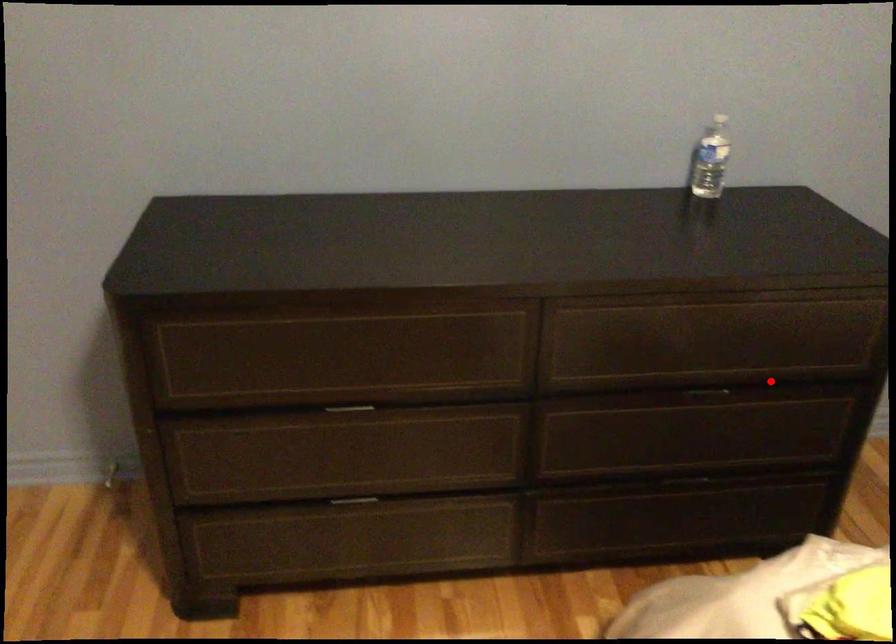
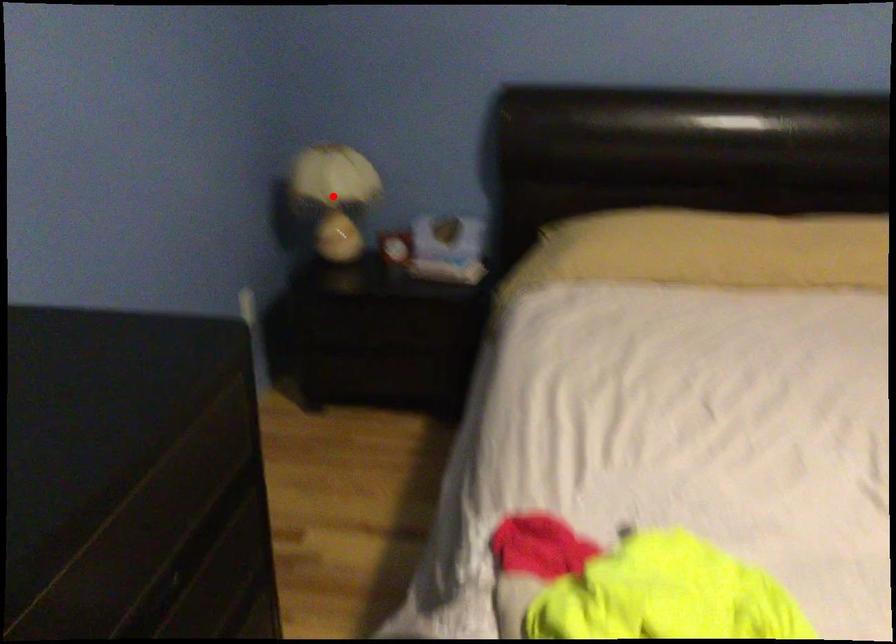
I am providing you with two images of the same scene from different viewpoints. A red point is marked on the first image and another point is marked on the second image. Is the red point in image1 aligned with the point shown in image2?

No